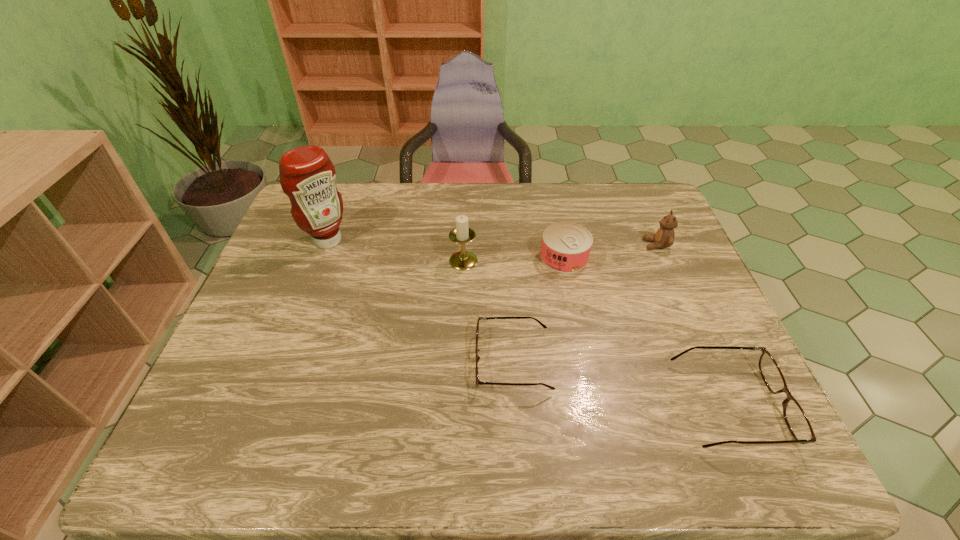
Identify the location of the shorter spectacles. (478, 382).

Locate an element on the screen. This screenshot has height=540, width=960. the shortest object is located at coordinates (478, 382).

Where is `the right spectacles`? The image size is (960, 540). the right spectacles is located at coordinates (796, 419).

Where is `the second shortest object`? the second shortest object is located at coordinates (796, 419).

Find the location of a particular element. the third shortest object is located at coordinates tap(566, 246).

This screenshot has width=960, height=540. I want to click on the fourth object from left to right, so click(x=566, y=246).

The width and height of the screenshot is (960, 540). I want to click on the third tallest object, so pyautogui.click(x=664, y=237).

At what (x,y) coordinates should I click in order to perform the action: click on the fifth shortest object. Please return your answer as a coordinate pair (x, y). Looking at the image, I should click on (462, 260).

Locate an element on the screen. The height and width of the screenshot is (540, 960). the leftmost object is located at coordinates (307, 176).

Image resolution: width=960 pixels, height=540 pixels. What are the coordinates of `condiment` in the screenshot? It's located at (307, 176).